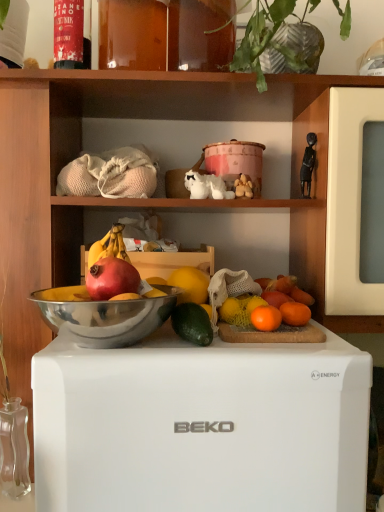
Find the location of `free spot in front of orange matte grapefruit at right, the 3th grapefruit from the left`. free spot in front of orange matte grapefruit at right, the 3th grapefruit from the left is located at coordinates (291, 341).